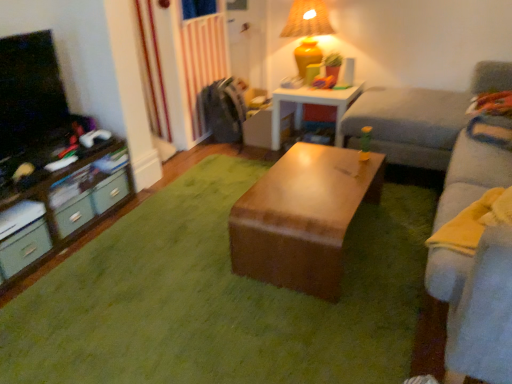
Locate an element on the screen. Image resolution: width=512 pixels, height=384 pixels. free location in front of wooden table at center, placed as the 1th table when sorted from front to back is located at coordinates (312, 319).